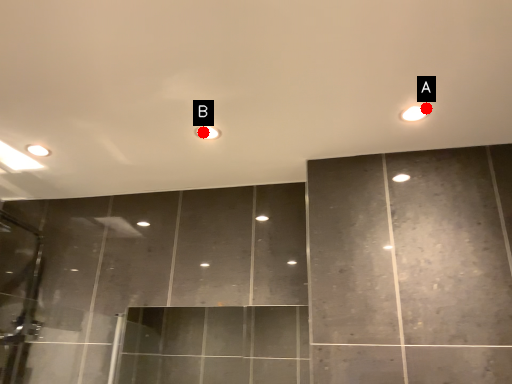
Question: Two points are circled on the image, labeled by A and B beside each circle. Which point is closer to the camera taking this photo?

Choices:
 (A) A is closer
 (B) B is closer

Answer: (A)